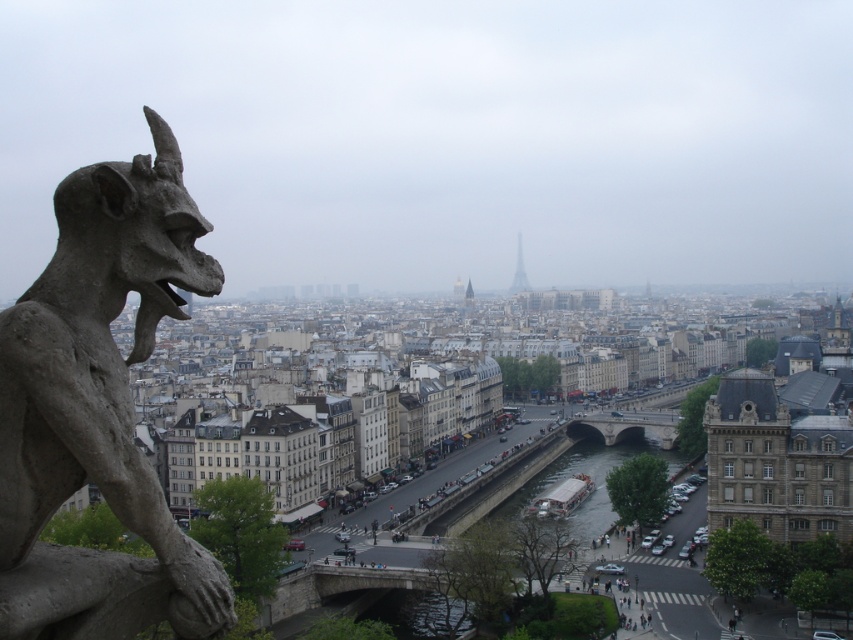
You are a tourist standing on the riverbank and want to take a photo of the gray stone gargoyle at left and the metallic silver tower at center. Which object will appear smaller in your photo?

The gray stone gargoyle at left will appear smaller in the photo because it is not as tall as the metallic silver tower at center.

You are a drone operator trying to capture a photo of the gray stone gargoyle at left from above. Given that the gargoyle is at coordinates point 0.639, 0.117, can you confirm if it is positioned on the left side of the image?

The gray stone gargoyle at left is located at point (x=99, y=408), which confirms it is positioned on the left side of the image as stated.